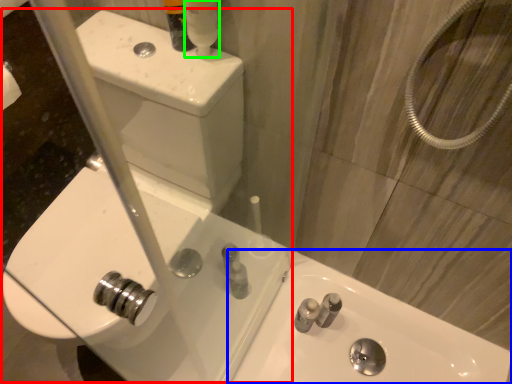
Question: Based on their relative distances, which object is nearer to sink (highlighted by a red box)? Choose from sink (highlighted by a blue box) and mouthwash (highlighted by a green box).

Choices:
 (A) sink
 (B) mouthwash

Answer: (A)